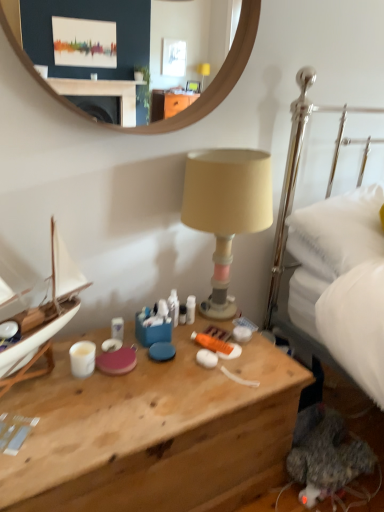
You are a GUI agent. You are given a task and a screenshot of the screen. Output one action in this format:
    pyautogui.click(x=<x>, y=<y>)
    Task: Click on the vacant point to the right of white glossy coffee cup at lower left
    Image resolution: width=384 pixels, height=512 pixels.
    Given the screenshot: What is the action you would take?
    pyautogui.click(x=139, y=383)